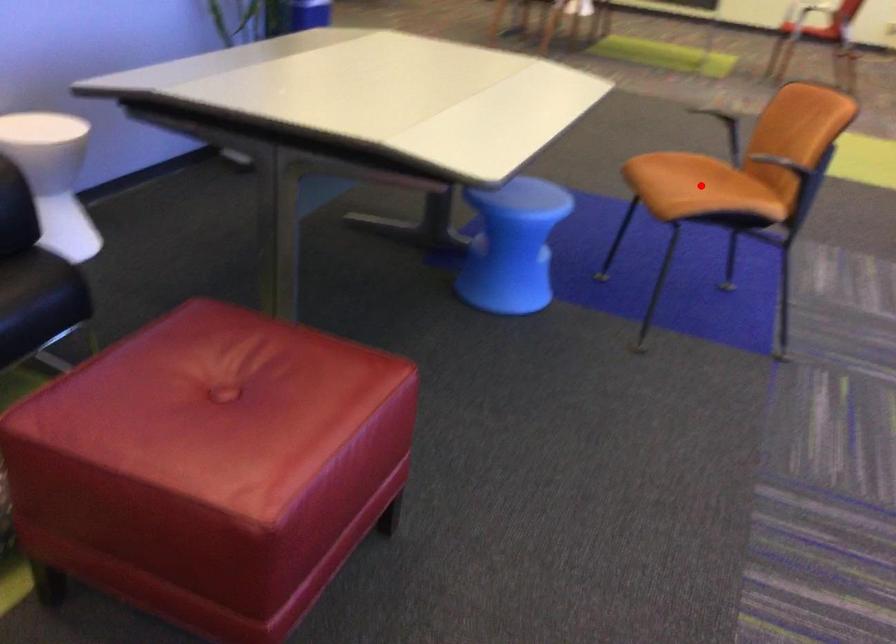
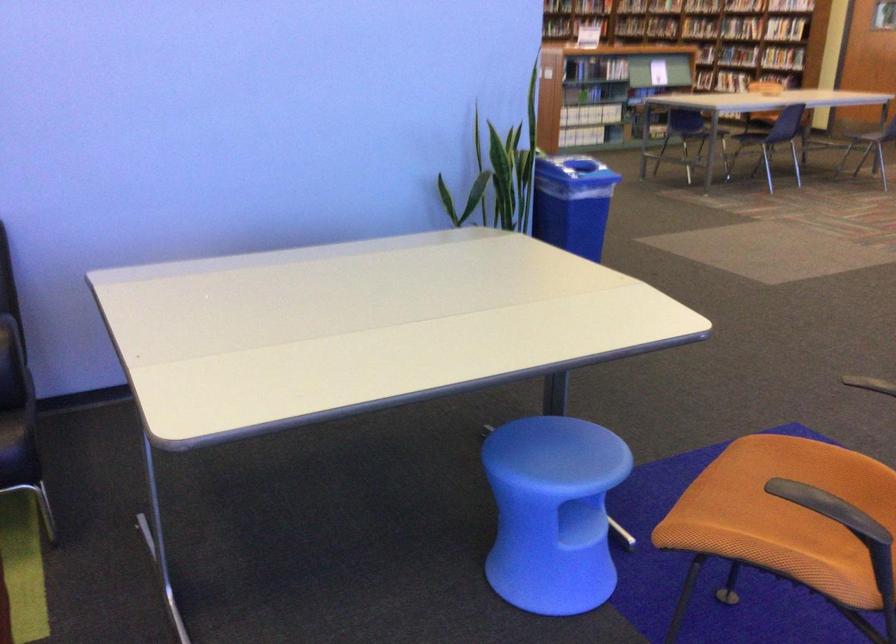
Where in the second image is the point corresponding to the highlighted location from the first image?

(785, 503)